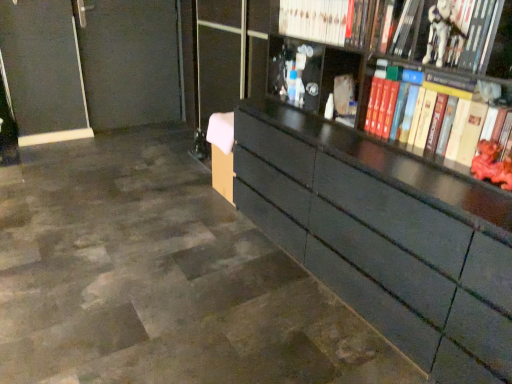
Question: Is hardcover book at right, acting as the 4th book starting from the top, thinner than white glossy book at upper center, the 4th book positioned from the bottom?

Choices:
 (A) no
 (B) yes

Answer: (B)

Question: Is hardcover book at right, acting as the 4th book starting from the top, closer to the viewer compared to white glossy book at upper center, the 4th book positioned from the bottom?

Choices:
 (A) no
 (B) yes

Answer: (B)

Question: Is hardcover book at right, acting as the 4th book starting from the top, in contact with white glossy book at upper center, the 1th book when ordered from top to bottom?

Choices:
 (A) yes
 (B) no

Answer: (B)

Question: Is hardcover book at right, the first book when ordered from bottom to top, turned away from white glossy book at upper center, the 1th book when ordered from top to bottom?

Choices:
 (A) yes
 (B) no

Answer: (B)

Question: Does hardcover book at right, acting as the 4th book starting from the top, have a greater height compared to white glossy book at upper center, the 1th book when ordered from top to bottom?

Choices:
 (A) no
 (B) yes

Answer: (B)

Question: From a real-world perspective, is white glossy book at upper center, the 4th book positioned from the bottom, above or below hardcover book at right, acting as the 4th book starting from the top?

Choices:
 (A) above
 (B) below

Answer: (A)

Question: Looking at their shapes, would you say white glossy book at upper center, the 1th book when ordered from top to bottom, is wider or thinner than hardcover book at right, the first book when ordered from bottom to top?

Choices:
 (A) thin
 (B) wide

Answer: (B)

Question: Is white glossy book at upper center, the 4th book positioned from the bottom, inside the boundaries of hardcover book at right, the first book when ordered from bottom to top, or outside?

Choices:
 (A) inside
 (B) outside

Answer: (B)

Question: Does point (315, 16) appear closer or farther from the camera than point (389, 79)?

Choices:
 (A) closer
 (B) farther

Answer: (B)

Question: From a real-world perspective, relative to white glossy book at upper center, the 4th book positioned from the bottom, is transparent glass door at center vertically above or below?

Choices:
 (A) above
 (B) below

Answer: (B)

Question: In terms of width, does transparent glass door at center look wider or thinner when compared to white glossy book at upper center, the 4th book positioned from the bottom?

Choices:
 (A) wide
 (B) thin

Answer: (B)

Question: Would you say transparent glass door at center is to the left or to the right of white glossy book at upper center, the 1th book when ordered from top to bottom, in the picture?

Choices:
 (A) right
 (B) left

Answer: (B)

Question: Considering the positions of transparent glass door at center and white glossy book at upper center, the 4th book positioned from the bottom, in the image, is transparent glass door at center bigger or smaller than white glossy book at upper center, the 4th book positioned from the bottom,?

Choices:
 (A) small
 (B) big

Answer: (B)

Question: From a real-world perspective, is transparent glass door at center physically located above or below rubberized red toy at right, which appears as the second toy when viewed from the top?

Choices:
 (A) above
 (B) below

Answer: (B)

Question: Is point (240, 64) closer or farther from the camera than point (479, 167)?

Choices:
 (A) closer
 (B) farther

Answer: (B)